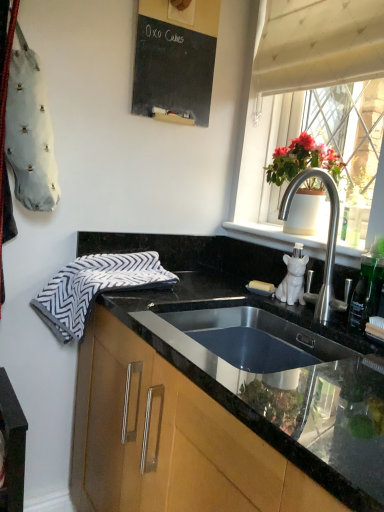
Question: From the image's perspective, is wooden cabinet at lower center below gray and white zigzag-patterned hand towel at left?

Choices:
 (A) yes
 (B) no

Answer: (A)

Question: Could you tell me if wooden cabinet at lower center is turned towards gray and white zigzag-patterned hand towel at left?

Choices:
 (A) no
 (B) yes

Answer: (B)

Question: From the image's perspective, is wooden cabinet at lower center located above gray and white zigzag-patterned hand towel at left?

Choices:
 (A) yes
 (B) no

Answer: (B)

Question: Is wooden cabinet at lower center completely or partially outside of gray and white zigzag-patterned hand towel at left?

Choices:
 (A) yes
 (B) no

Answer: (A)

Question: Are wooden cabinet at lower center and gray and white zigzag-patterned hand towel at left far apart?

Choices:
 (A) yes
 (B) no

Answer: (B)

Question: Can you confirm if wooden cabinet at lower center is shorter than gray and white zigzag-patterned hand towel at left?

Choices:
 (A) yes
 (B) no

Answer: (B)

Question: From the image's perspective, is gray and white zigzag-patterned hand towel at left located beneath white textured curtain at upper right?

Choices:
 (A) yes
 (B) no

Answer: (A)

Question: Would you say gray and white zigzag-patterned hand towel at left is a long distance from white textured curtain at upper right?

Choices:
 (A) yes
 (B) no

Answer: (B)

Question: Is gray and white zigzag-patterned hand towel at left positioned with its back to white textured curtain at upper right?

Choices:
 (A) yes
 (B) no

Answer: (B)

Question: Is gray and white zigzag-patterned hand towel at left shorter than white textured curtain at upper right?

Choices:
 (A) yes
 (B) no

Answer: (A)

Question: Is gray and white zigzag-patterned hand towel at left aimed at white textured curtain at upper right?

Choices:
 (A) no
 (B) yes

Answer: (A)

Question: Considering the relative sizes of gray and white zigzag-patterned hand towel at left and white textured curtain at upper right in the image provided, is gray and white zigzag-patterned hand towel at left wider than white textured curtain at upper right?

Choices:
 (A) yes
 (B) no

Answer: (A)

Question: Can you confirm if black chalkboard at upper center is bigger than wooden cabinet at lower center?

Choices:
 (A) yes
 (B) no

Answer: (B)